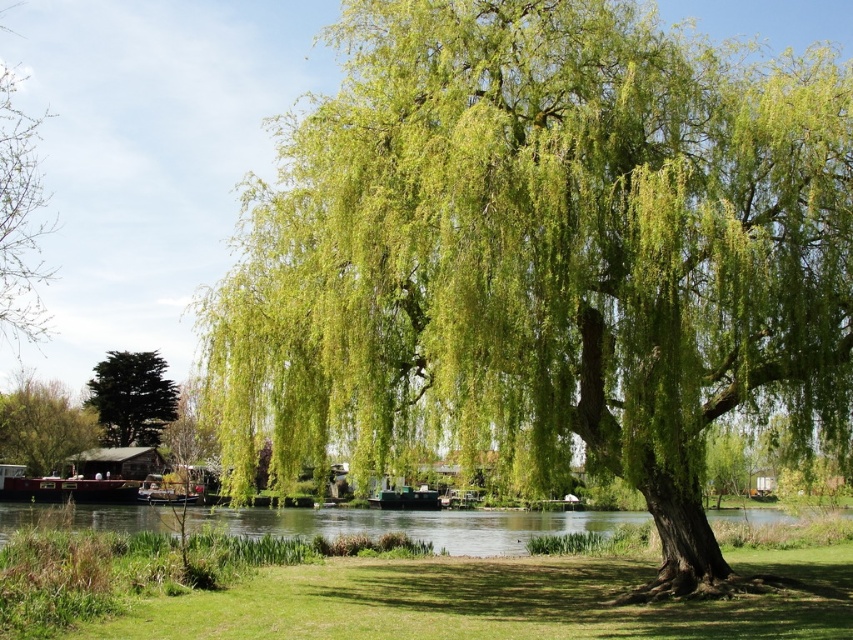
Does green grassy river at lower center have a larger size compared to green leafy tree at upper left?

Incorrect, green grassy river at lower center is not larger than green leafy tree at upper left.

Can you confirm if green grassy river at lower center is positioned above green leafy tree at upper left?

No, green grassy river at lower center is not above green leafy tree at upper left.

Identify the location of green grassy river at lower center. Image resolution: width=853 pixels, height=640 pixels. (418, 524).

The width and height of the screenshot is (853, 640). I want to click on green grassy river at lower center, so click(x=418, y=524).

Does point (660, 120) come closer to viewer compared to point (57, 442)?

That is True.

Is green leafy willow at center shorter than green leafy tree at center?

In fact, green leafy willow at center may be taller than green leafy tree at center.

Who is more forward, (347, 164) or (54, 397)?

Positioned in front is point (347, 164).

The width and height of the screenshot is (853, 640). Identify the location of green leafy willow at center. (544, 256).

Is green leafy willow at center above green grass at lower center?

Correct, green leafy willow at center is located above green grass at lower center.

What do you see at coordinates (544, 256) in the screenshot? The image size is (853, 640). I see `green leafy willow at center` at bounding box center [544, 256].

Locate an element on the screen. The image size is (853, 640). green leafy willow at center is located at coordinates (544, 256).